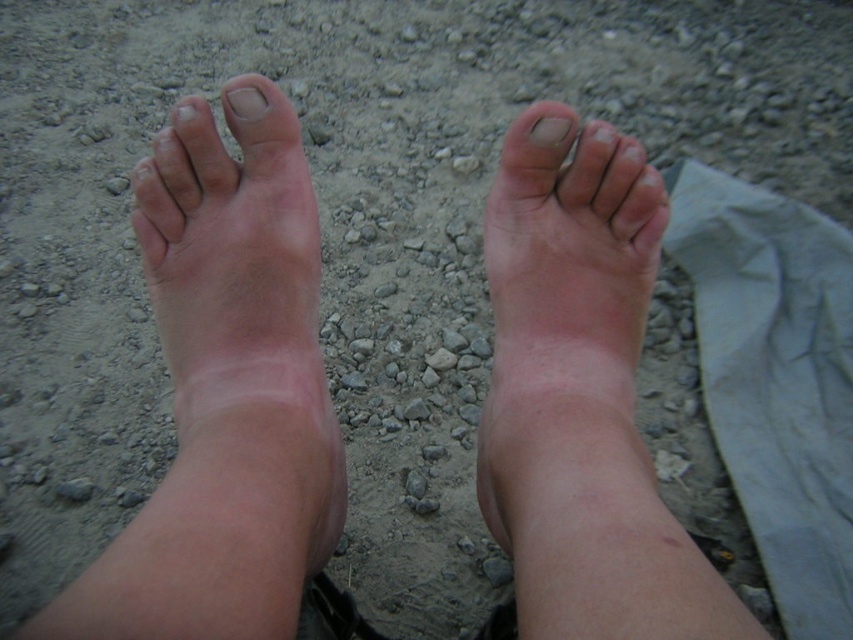
Is pink smooth skin at center taller than pink skin at center?

Yes, pink smooth skin at center is taller than pink skin at center.

Can you confirm if pink smooth skin at center is positioned to the right of pink skin at center?

Incorrect, pink smooth skin at center is not on the right side of pink skin at center.

Image resolution: width=853 pixels, height=640 pixels. What are the coordinates of `pink smooth skin at center` in the screenshot? It's located at (236, 349).

The width and height of the screenshot is (853, 640). In order to click on pink smooth skin at center in this screenshot , I will do [236, 349].

Based on the photo, does pink smooth skin at center appear over matte skin toe at center?

Incorrect, pink smooth skin at center is not positioned above matte skin toe at center.

Between point (257, 436) and point (538, 131), which one is positioned behind?

Positioned behind is point (538, 131).

Identify the location of pink smooth skin at center. (236, 349).

Can you confirm if pink skin at center is positioned to the left of nail at center?

No, pink skin at center is not to the left of nail at center.

Can you confirm if pink skin at center is smaller than nail at center?

Incorrect, pink skin at center is not smaller in size than nail at center.

Is point (595, 145) positioned after point (223, 97)?

No.

Locate an element on the screen. pink skin at center is located at coordinates (569, 346).